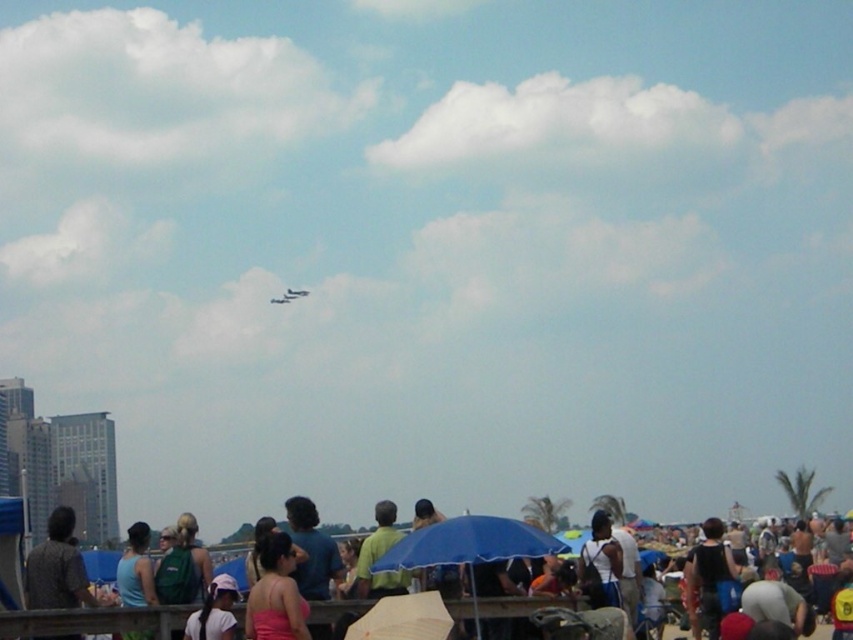
Question: Which point is closer to the camera?

Choices:
 (A) (283, 298)
 (B) (363, 593)

Answer: (B)

Question: Estimate the real-world distances between objects in this image. Which object is farther from the pink fabric cap at lower center?

Choices:
 (A) shiny silver airplane at upper center
 (B) blue matte umbrella at center
 (C) metallic silver airplane at center
 (D) pink fabric dress at center

Answer: (C)

Question: Which object is positioned closest to the metallic silver airplane at center?

Choices:
 (A) blue matte umbrella at center
 (B) pink fabric cap at lower center

Answer: (A)

Question: Can you confirm if blue matte umbrella at center is thinner than pink matte tank top at center?

Choices:
 (A) no
 (B) yes

Answer: (A)

Question: Can you confirm if green fabric shirt at center is thinner than shiny silver airplane at upper center?

Choices:
 (A) yes
 (B) no

Answer: (A)

Question: Is pink fabric dress at center positioned in front of metallic silver airplane at upper center?

Choices:
 (A) no
 (B) yes

Answer: (B)